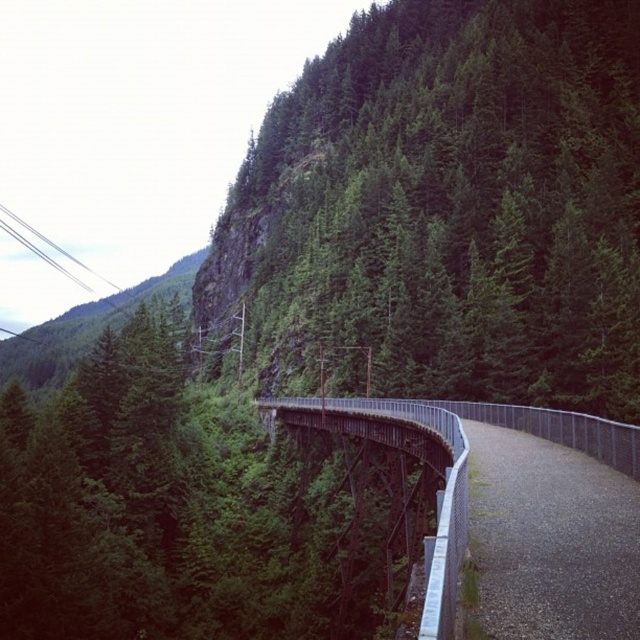
Question: Does green leafy tree at center appear on the left side of gray gravel path at center-right?

Choices:
 (A) no
 (B) yes

Answer: (B)

Question: Can you confirm if green leafy tree at center is thinner than metallic gray bridge at center?

Choices:
 (A) no
 (B) yes

Answer: (A)

Question: In this image, where is gray gravel path at center-right located relative to metallic gray bridge at center?

Choices:
 (A) below
 (B) above

Answer: (B)

Question: Estimate the real-world distances between objects in this image. Which object is closer to the metallic gray bridge at center?

Choices:
 (A) gray gravel path at center-right
 (B) green leafy tree at center

Answer: (A)

Question: Considering the real-world distances, which object is farthest from the metallic gray bridge at center?

Choices:
 (A) green leafy tree at center
 (B) gray gravel path at center-right

Answer: (A)

Question: Which point is closer to the camera?

Choices:
 (A) gray gravel path at center-right
 (B) metallic gray bridge at center

Answer: (B)